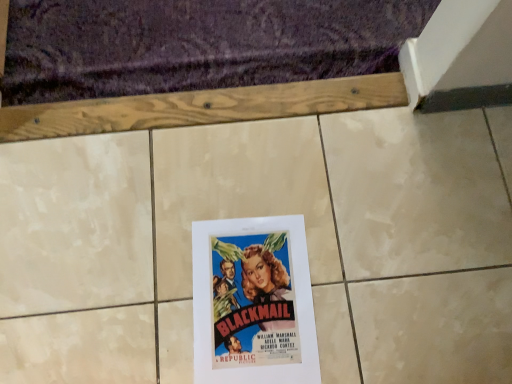
This screenshot has height=384, width=512. Identify the location of free space above matte paper poster at center (from a real-world perspective). (253, 296).